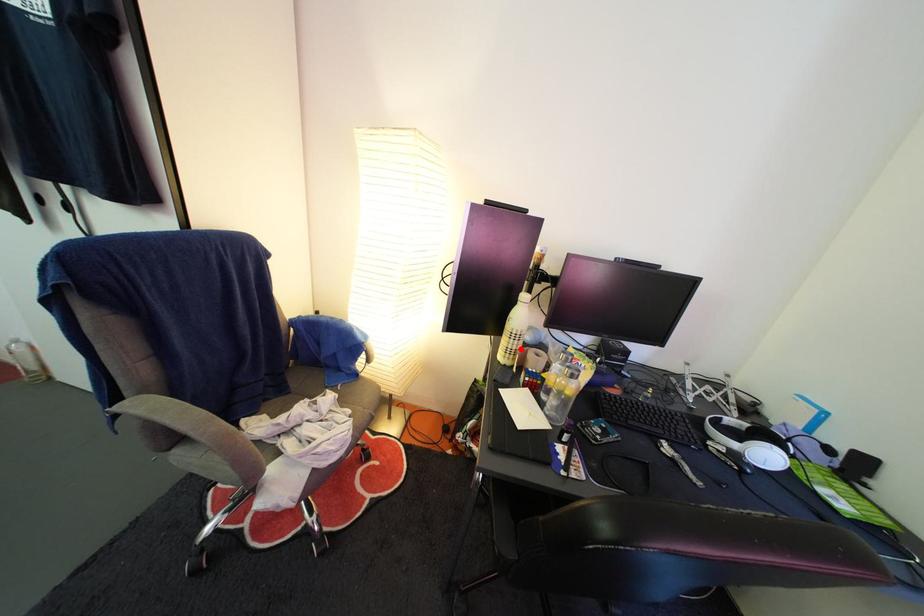
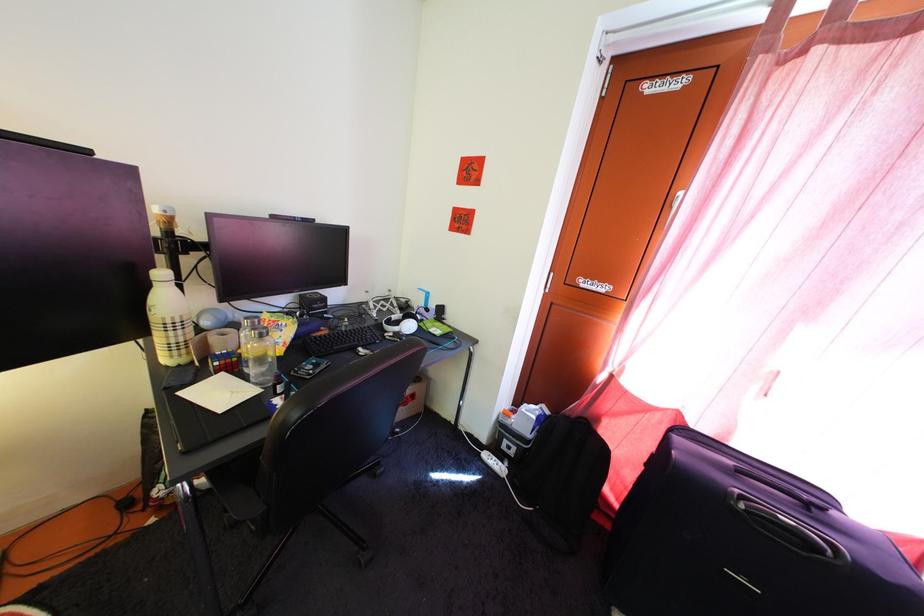
Find the pixel in the second image that matches the highlighted location in the first image.

(179, 341)